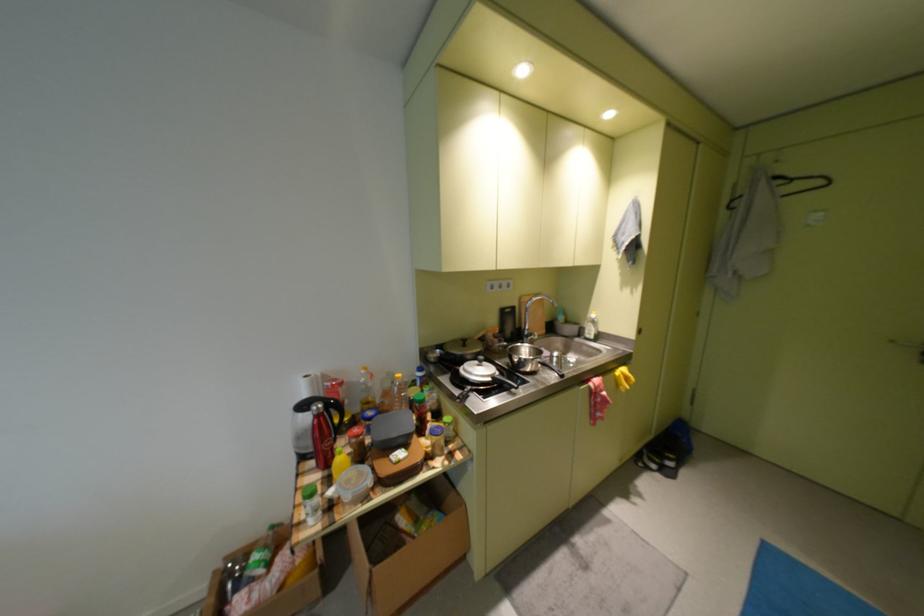
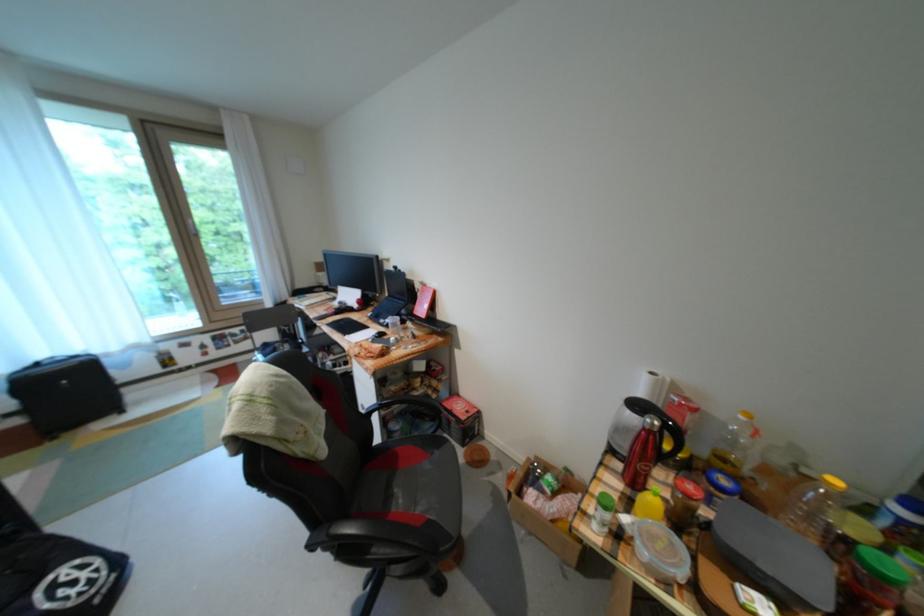
Where in the second image is the point corresponding to pixel 322 451 from the first image?

(636, 455)